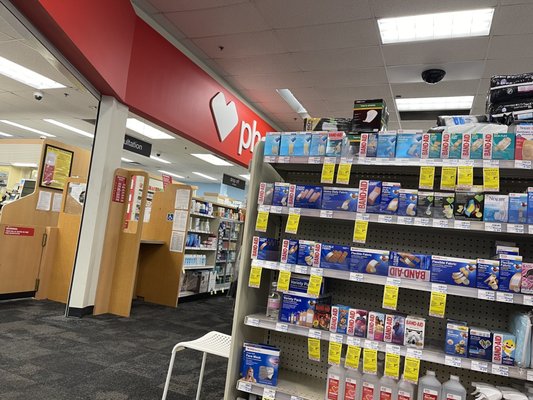
You are a GUI agent. You are given a task and a screenshot of the screen. Output one action in this format:
    pyautogui.click(x=<x>, y=<y>)
    Task: Click on the door hinge
    This screenshot has height=400, width=533.
    Given the screenshot: What is the action you would take?
    pyautogui.click(x=39, y=286)